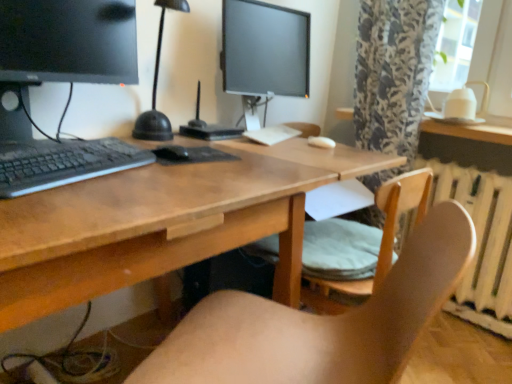
Locate an element on the screen. vacant region to the right of black matte keyboard at left is located at coordinates (179, 176).